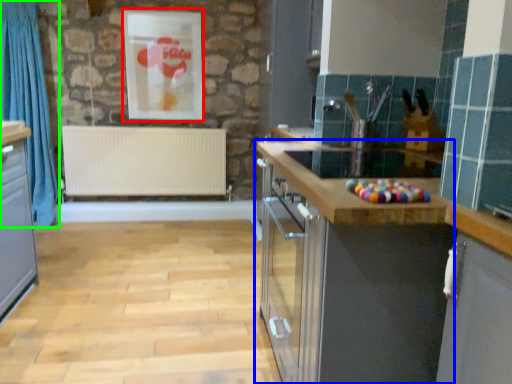
Question: Which object is the farthest from picture frame (highlighted by a red box)? Choose among these: cabinetry (highlighted by a blue box) or curtain (highlighted by a green box).

Choices:
 (A) cabinetry
 (B) curtain

Answer: (A)